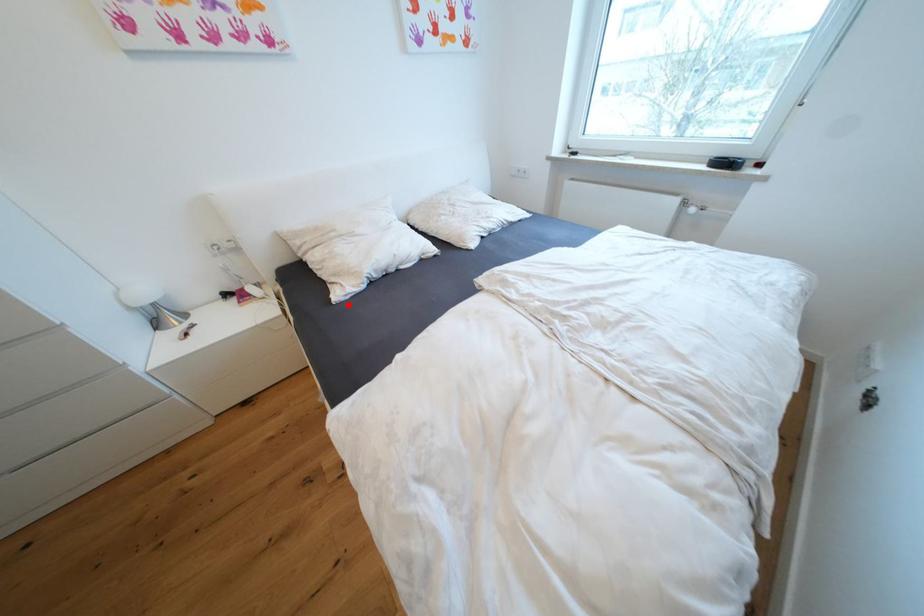
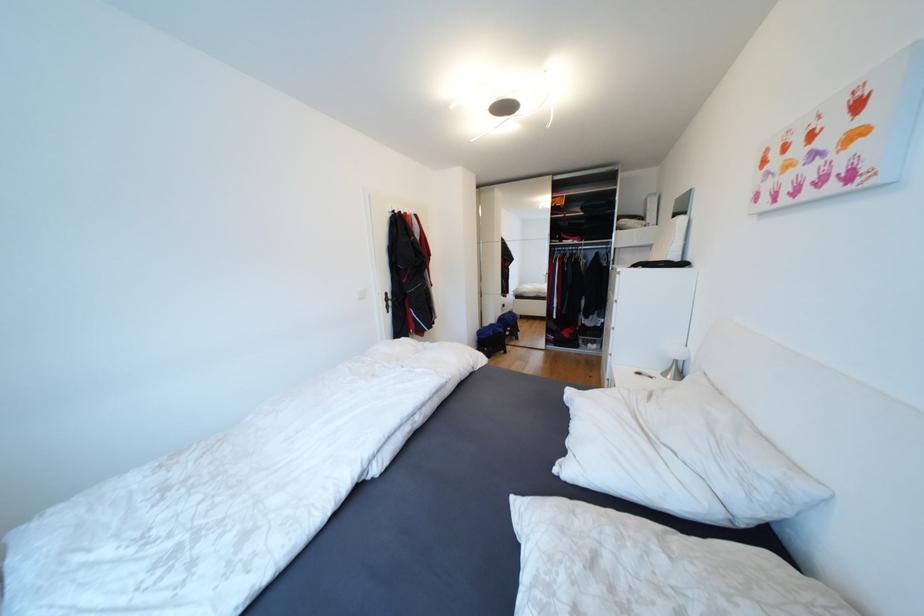
Where in the second image is the point corresponding to the highlighted location from the first image?

(570, 394)